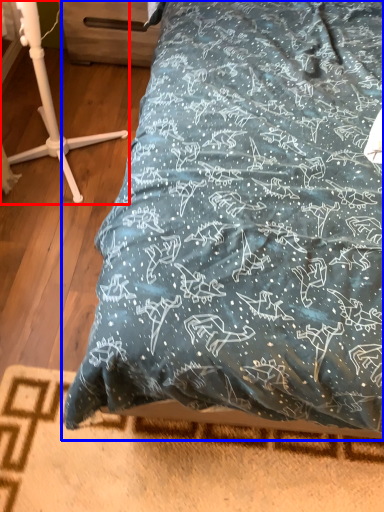
Question: Which point is further to the camera, furniture (highlighted by a red box) or bed (highlighted by a blue box)?

Choices:
 (A) furniture
 (B) bed

Answer: (B)